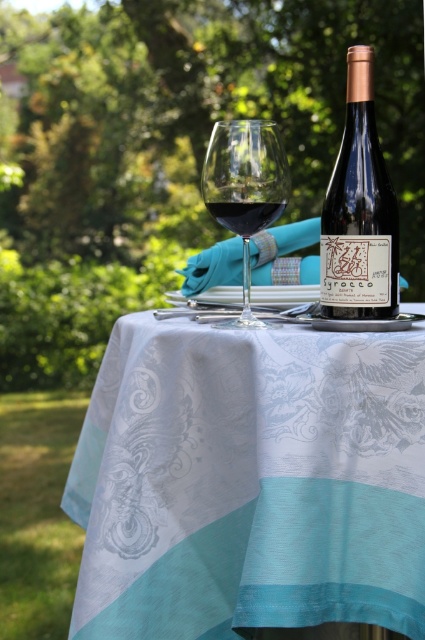
You are a guest at a garden party and want to place your phone on the table. The table has a silky blue tablecloth at center and a silky teal tablecloth at center. Which tablecloth should you place your phone on to ensure it is closer to you?

The silky blue tablecloth at center is in front of the silky teal tablecloth at center, so placing your phone on the silky blue tablecloth at center will make it closer to you.

You are a guest at a garden party and notice the transparent glass at center and the silky teal tablecloth at center. Which object is closer to you from your viewpoint?

The transparent glass at center is closer to you because it is in front of the silky teal tablecloth at center.

You are setting up a picnic and have two tablecloths, the silky blue tablecloth at center and the silky teal tablecloth at center. Which one is wider?

The silky blue tablecloth at center is wider than the silky teal tablecloth at center according to the description.